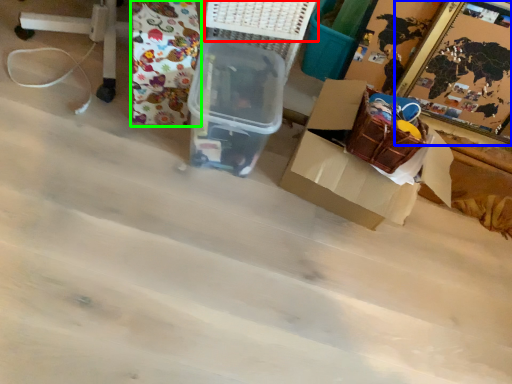
Question: Based on their relative distances, which object is farther from basket (highlighted by a red box)? Choose from picture frame (highlighted by a blue box) and wrapping paper (highlighted by a green box).

Choices:
 (A) picture frame
 (B) wrapping paper

Answer: (A)